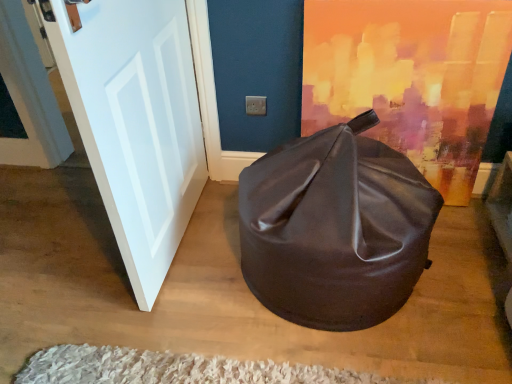
The height and width of the screenshot is (384, 512). I want to click on vacant area that is in front of white glossy door at left, so click(x=169, y=307).